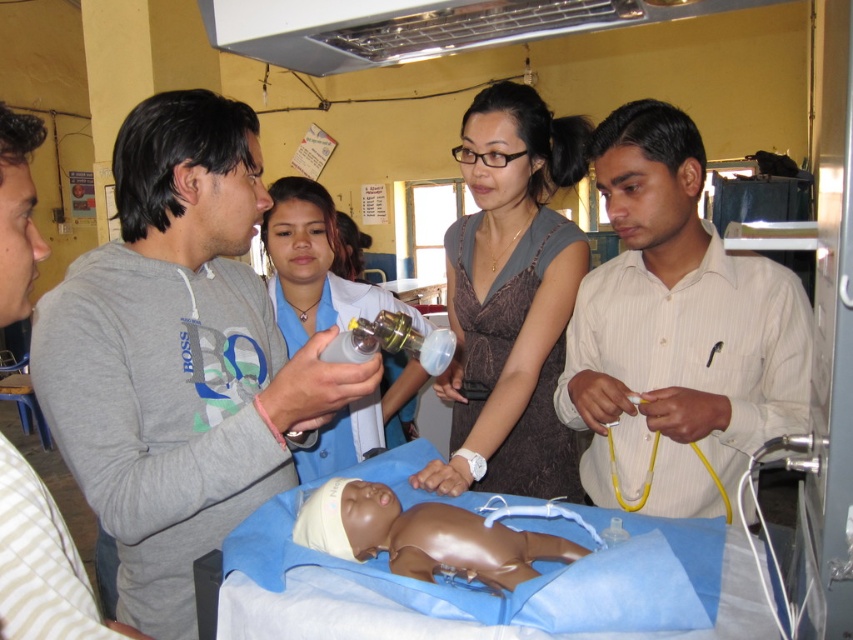
Who is taller, gray cotton sweatshirt at center or smooth plastic baby at center?

gray cotton sweatshirt at center is taller.

Does point (192, 237) come behind point (347, 557)?

That is True.

Is point (155, 134) closer to camera compared to point (317, 541)?

No, (155, 134) is further to viewer.

The height and width of the screenshot is (640, 853). I want to click on gray cotton sweatshirt at center, so click(x=178, y=356).

Which is behind, point (656, 154) or point (567, 177)?

Point (567, 177)

Is white striped shirt at center to the left of matte gray dress at center from the viewer's perspective?

No, white striped shirt at center is not to the left of matte gray dress at center.

Describe the element at coordinates (676, 330) in the screenshot. I see `white striped shirt at center` at that location.

Locate an element on the screen. This screenshot has width=853, height=640. white striped shirt at center is located at coordinates (676, 330).

Does gray cotton sweatshirt at center have a larger size compared to white striped shirt at center?

Yes, gray cotton sweatshirt at center is bigger than white striped shirt at center.

Measure the distance between gray cotton sweatshirt at center and white striped shirt at center.

They are 24.98 inches apart.

What do you see at coordinates (178, 356) in the screenshot? I see `gray cotton sweatshirt at center` at bounding box center [178, 356].

The width and height of the screenshot is (853, 640). I want to click on gray cotton sweatshirt at center, so click(178, 356).